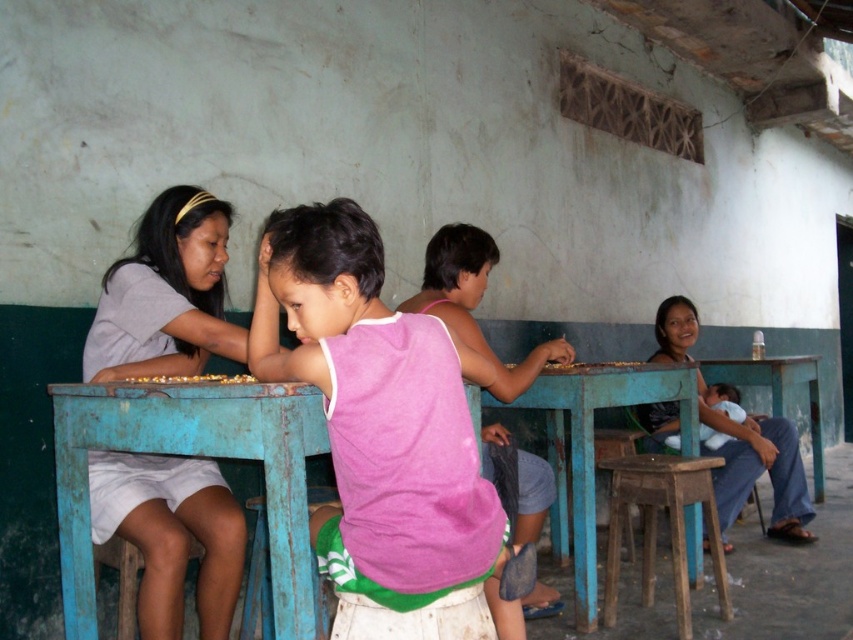
Is pink fabric shirt at right shorter than wooden stool at lower center?

Incorrect, pink fabric shirt at right's height does not fall short of wooden stool at lower center's.

Who is higher up, pink fabric shirt at right or wooden stool at lower center?

Positioned higher is pink fabric shirt at right.

Who is more forward, [788,458] or [605,442]?

Positioned in front is point [605,442].

Where is `pink fabric shirt at right`? The width and height of the screenshot is (853, 640). pink fabric shirt at right is located at coordinates (758, 468).

In order to click on blue painted wood table at left in this screenshot , I will do `click(192, 454)`.

Between blue painted wood table at left and wooden stool at lower center, which one appears on the left side from the viewer's perspective?

Positioned to the left is blue painted wood table at left.

Image resolution: width=853 pixels, height=640 pixels. In order to click on blue painted wood table at left in this screenshot , I will do `click(192, 454)`.

Between pink fabric shirt at center and rusty wood stool at lower center, which one is positioned lower?

rusty wood stool at lower center

Who is shorter, pink fabric shirt at center or rusty wood stool at lower center?

rusty wood stool at lower center

What do you see at coordinates (474, 304) in the screenshot?
I see `pink fabric shirt at center` at bounding box center [474, 304].

Locate an element on the screen. pink fabric shirt at center is located at coordinates (474, 304).